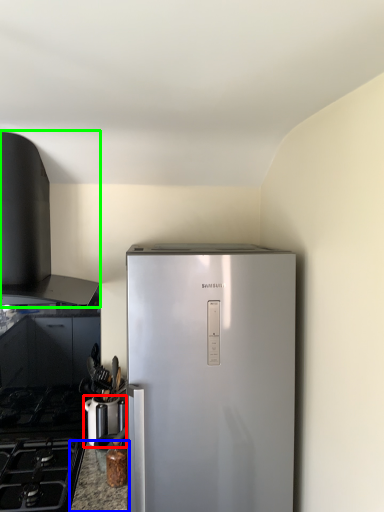
Question: Based on their relative distances, which object is nearer to appliance (highlighted by a red box)? Choose from counter top (highlighted by a blue box) and vent (highlighted by a green box).

Choices:
 (A) counter top
 (B) vent

Answer: (A)